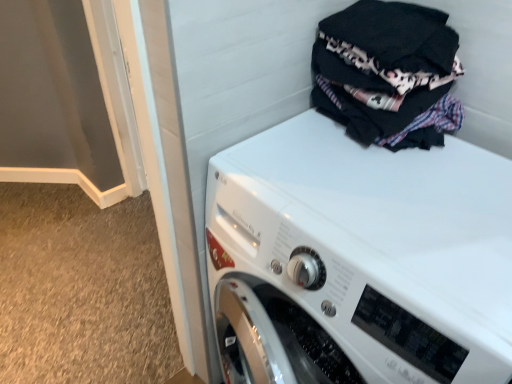
The width and height of the screenshot is (512, 384). In order to click on vacant point to the left of black cotton laundry at upper right in this screenshot , I will do `click(284, 151)`.